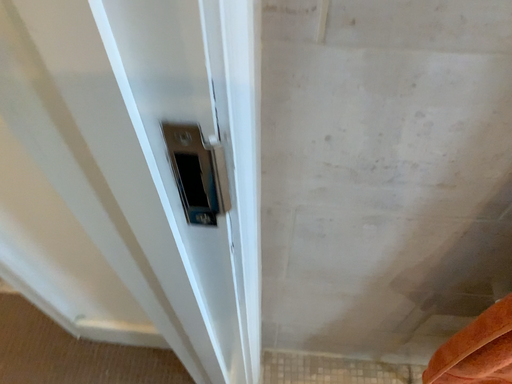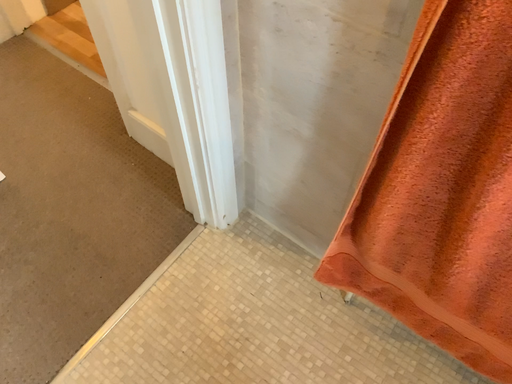
Question: How did the camera likely rotate when shooting the video?

Choices:
 (A) rotated left
 (B) rotated right

Answer: (A)